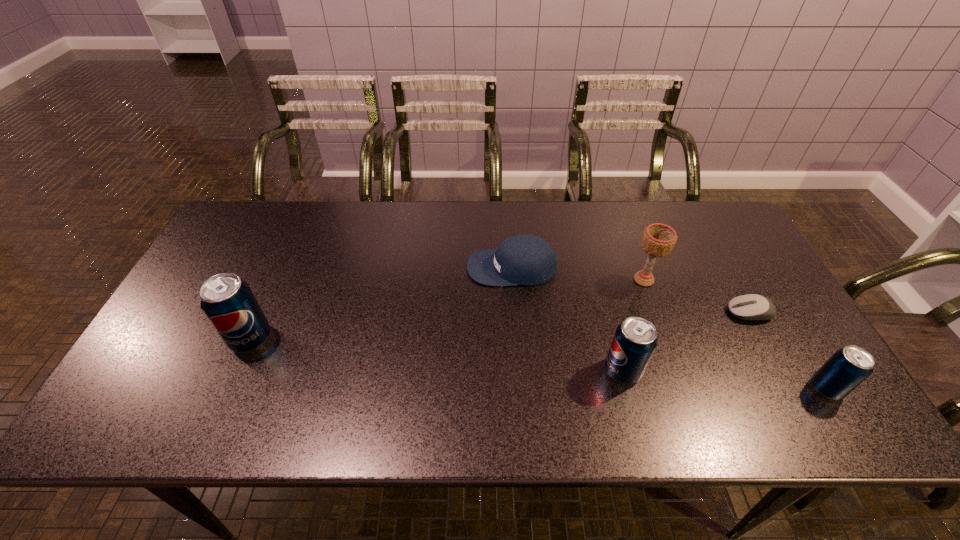
Find the location of a particular element. This screenshot has width=960, height=540. free space that satisfies the following two spatial constraints: 1. on the front side of the leftmost object; 2. on the right side of the fourth object from right to left is located at coordinates (236, 370).

This screenshot has width=960, height=540. In order to click on vacant region that satisfies the following two spatial constraints: 1. on the front-facing side of the second shortest object; 2. on the left side of the fourth tallest object in this screenshot , I will do `click(520, 388)`.

In order to click on free region that satisfies the following two spatial constraints: 1. on the front-facing side of the fifth object from right to left; 2. on the back side of the chalice in this screenshot , I will do `click(513, 280)`.

At what (x,y) coordinates should I click in order to perform the action: click on free point that satisfies the following two spatial constraints: 1. on the front-facing side of the second shortest object; 2. on the left side of the fourth tallest object. Please return your answer as a coordinate pair (x, y). This screenshot has width=960, height=540. Looking at the image, I should click on (520, 388).

I want to click on vacant space that satisfies the following two spatial constraints: 1. on the wheel side of the shortest object; 2. on the front side of the tallest soda can, so click(764, 339).